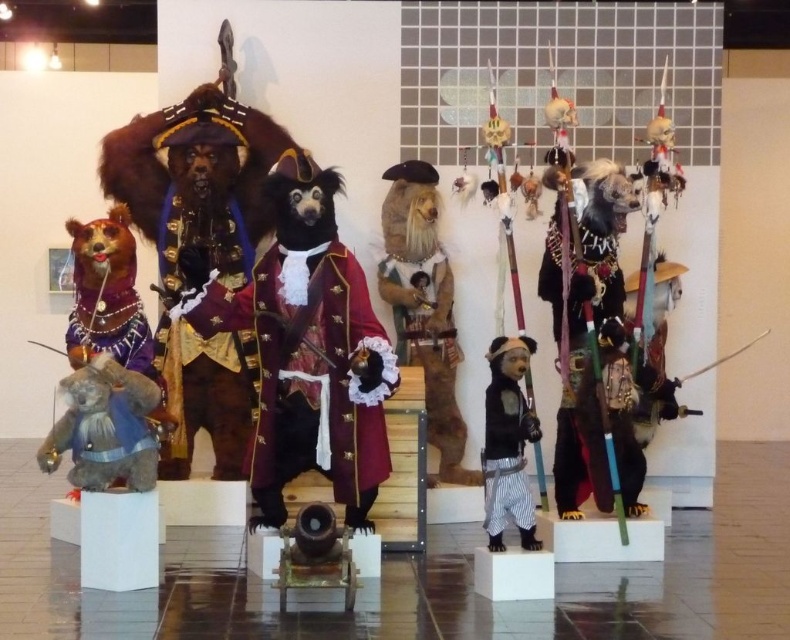
Question: Can you confirm if furry costume at center is positioned below fuzzy brown teddy bear at left?

Choices:
 (A) yes
 (B) no

Answer: (B)

Question: Among these objects, which one is farthest from the camera?

Choices:
 (A) furry costume at center
 (B) velvet maroon coat at center
 (C) matte black bear at center

Answer: (A)

Question: Does velvet maroon coat at center appear on the right side of furry costume at center?

Choices:
 (A) yes
 (B) no

Answer: (B)

Question: Which point is closer to the camera?

Choices:
 (A) (122, 468)
 (B) (502, 426)

Answer: (B)

Question: Which of the following is the closest to the observer?

Choices:
 (A) fuzzy brown teddy bear at left
 (B) velvet maroon coat at center
 (C) matte black bear at center
 (D) furry costume at center

Answer: (B)

Question: Where is velvet maroon coat at center located in relation to fuzzy brown teddy bear at left in the image?

Choices:
 (A) right
 (B) left

Answer: (A)